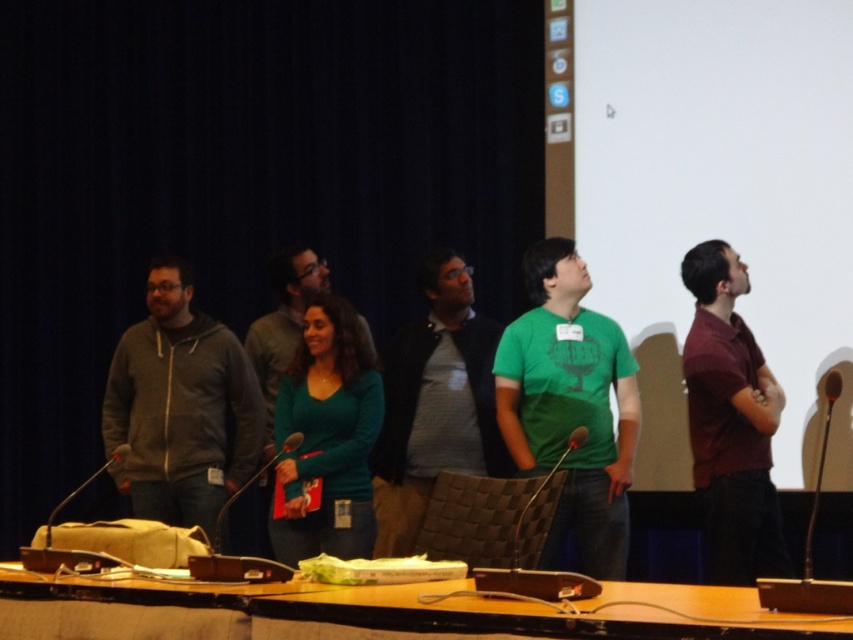
Is matte gray shirt at center bigger than teal matte sweater at center?

Yes, matte gray shirt at center is bigger than teal matte sweater at center.

Can you confirm if matte gray shirt at center is shorter than teal matte sweater at center?

In fact, matte gray shirt at center may be taller than teal matte sweater at center.

Find the location of a particular element. This screenshot has height=640, width=853. matte gray shirt at center is located at coordinates [x=434, y=403].

Where is `matte gray shirt at center`? The width and height of the screenshot is (853, 640). matte gray shirt at center is located at coordinates pos(434,403).

Between point (611, 477) and point (126, 436), which one is positioned in front?

Point (611, 477)

Which is more to the left, green matte shirt at center or gray zip-up hoodie at center?

From the viewer's perspective, gray zip-up hoodie at center appears more on the left side.

This screenshot has width=853, height=640. What are the coordinates of `green matte shirt at center` in the screenshot? It's located at (570, 404).

Who is more distant from viewer, (x=518, y=445) or (x=387, y=358)?

Positioned behind is point (x=387, y=358).

Based on the photo, can you confirm if green matte shirt at center is wider than matte gray shirt at center?

In fact, green matte shirt at center might be narrower than matte gray shirt at center.

The width and height of the screenshot is (853, 640). I want to click on green matte shirt at center, so click(570, 404).

You are a GUI agent. You are given a task and a screenshot of the screen. Output one action in this format:
    pyautogui.click(x=<x>, y=<y>)
    Task: Click on the green matte shirt at center
    
    Given the screenshot: What is the action you would take?
    pyautogui.click(x=570, y=404)